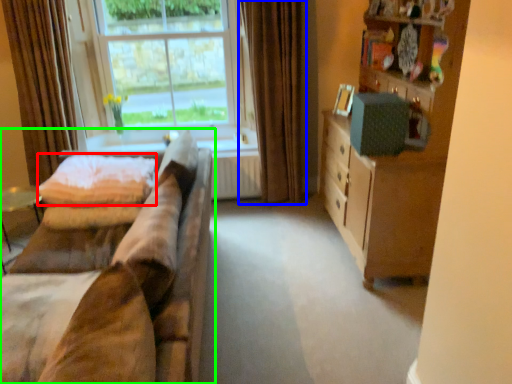
Question: Estimate the real-world distances between objects in this image. Which object is farther from quilt (highlighted by a red box), curtain (highlighted by a blue box) or studio couch (highlighted by a green box)?

Choices:
 (A) curtain
 (B) studio couch

Answer: (A)